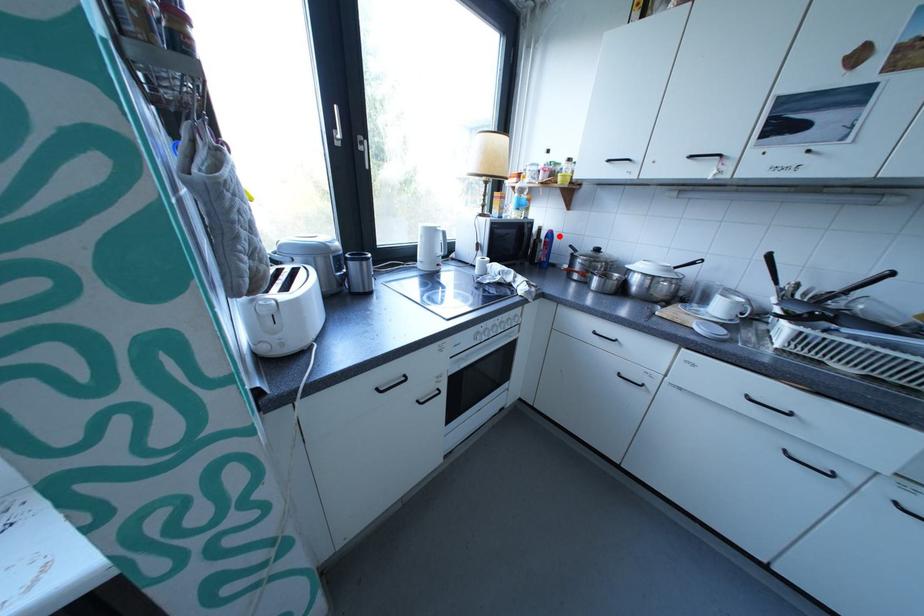
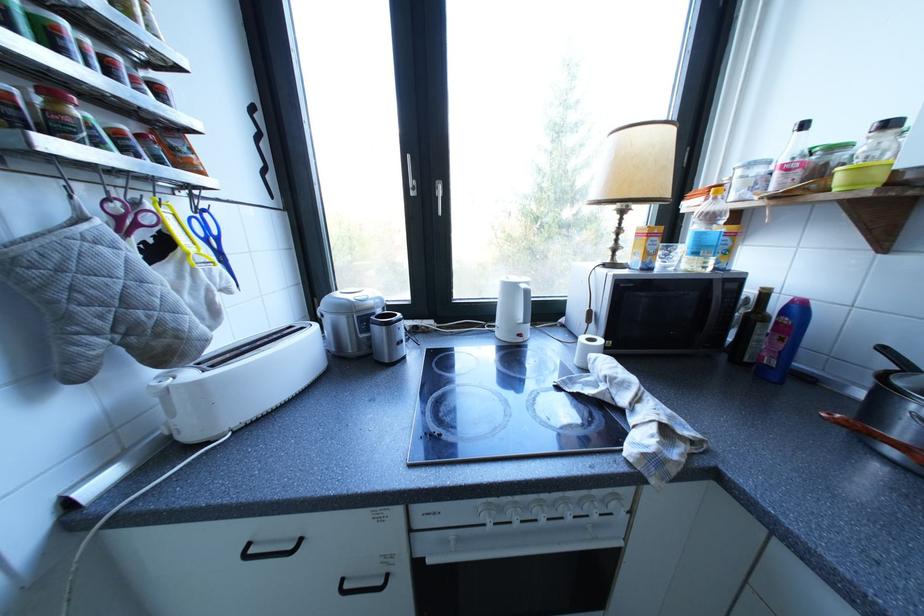
Question: I am providing you with two images of the same scene from different viewpoints. In image1, a red point is highlighted. Considering the same 3D point in image2, which of the following is correct?

Choices:
 (A) It is closer
 (B) It is farther

Answer: (B)